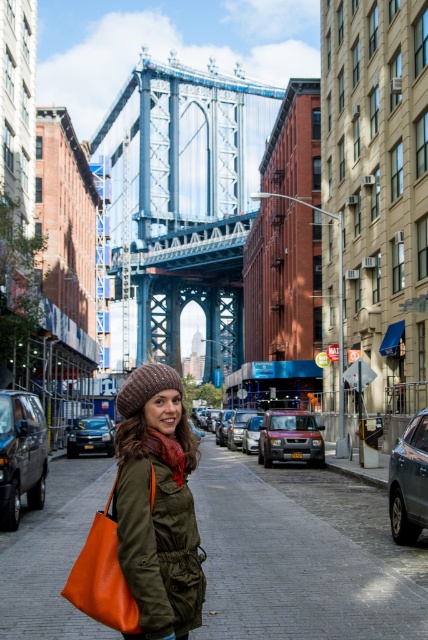
Question: Which object is positioned farthest from the orange leather tote at lower left?

Choices:
 (A) shiny black car at lower left
 (B) matte red suv at center
 (C) shiny black sedan at center
 (D) shiny silver car at right

Answer: (C)

Question: From the image, what is the correct spatial relationship of matte asphalt pavement at center in relation to shiny silver car at right?

Choices:
 (A) above
 (B) below

Answer: (B)

Question: Considering the real-world distances, which object is farthest from the matte silver suv at center?

Choices:
 (A) matte olive green jacket at center
 (B) shiny silver car at right
 (C) matte red suv at center

Answer: (A)

Question: Which point appears farthest from the camera in this image?

Choices:
 (A) (157, 452)
 (B) (2, 410)

Answer: (B)

Question: Observing the image, what is the correct spatial positioning of shiny silver car at right in reference to shiny black sedan at center?

Choices:
 (A) below
 (B) above

Answer: (B)

Question: Is matte red suv at center to the right of shiny black sedan at center from the viewer's perspective?

Choices:
 (A) yes
 (B) no

Answer: (A)